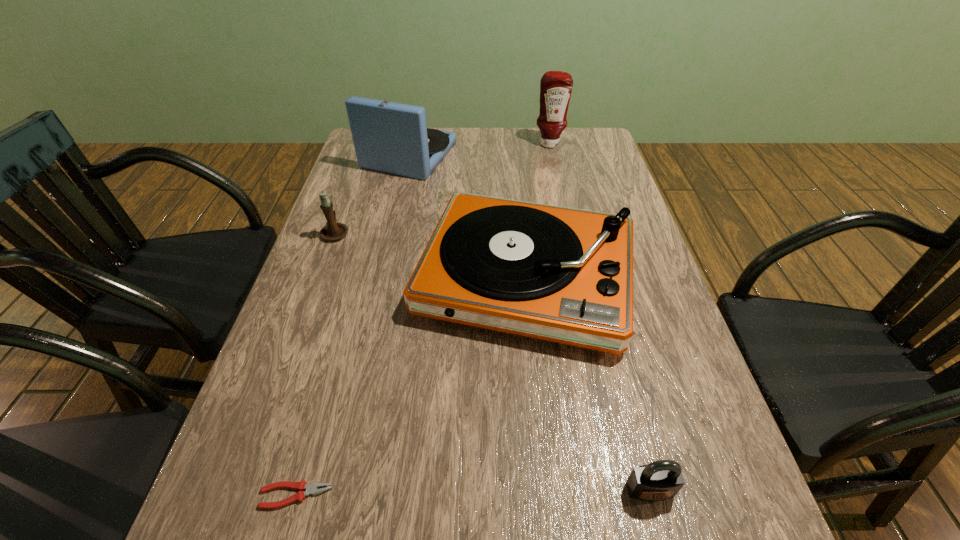
You are a GUI agent. You are given a task and a screenshot of the screen. Output one action in this format:
    pyautogui.click(x=<x>, y=<y>)
    Task: Click on the free space between the phonograph record and the candle holder
    
    Given the screenshot: What is the action you would take?
    372,194

I want to click on unoccupied area between the candle holder and the padlock, so click(x=492, y=361).

Locate an element on the screen. vacant area between the shortest object and the record player is located at coordinates (411, 386).

This screenshot has width=960, height=540. What are the coordinates of `vacant area that lies between the condiment and the candle holder` in the screenshot? It's located at (443, 188).

At what (x,y) coordinates should I click in order to perform the action: click on object that stands as the second closest to the condiment. Please return your answer as a coordinate pair (x, y). The width and height of the screenshot is (960, 540). Looking at the image, I should click on (565, 275).

The height and width of the screenshot is (540, 960). What are the coordinates of `the second closest object to the shortest object` in the screenshot? It's located at (660, 480).

Locate an element on the screen. The width and height of the screenshot is (960, 540). free point that satisfies the following two spatial constraints: 1. on the side of the condiment with the handle; 2. on the left side of the candle holder is located at coordinates (368, 144).